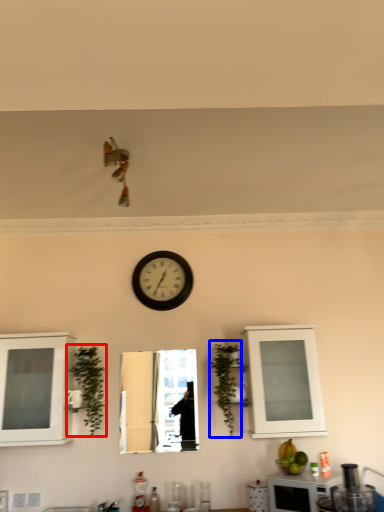
Question: Which point is closer to the camera, plant (highlighted by a red box) or plant (highlighted by a blue box)?

Choices:
 (A) plant
 (B) plant

Answer: (A)